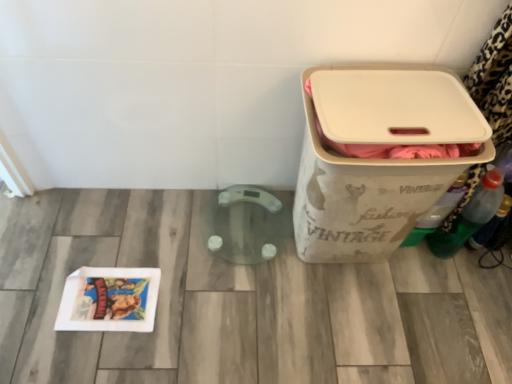
Where is `free location to the right of green plastic bottle at right, arranged as the second bottle when viewed from the right`? This screenshot has width=512, height=384. free location to the right of green plastic bottle at right, arranged as the second bottle when viewed from the right is located at coordinates (485, 265).